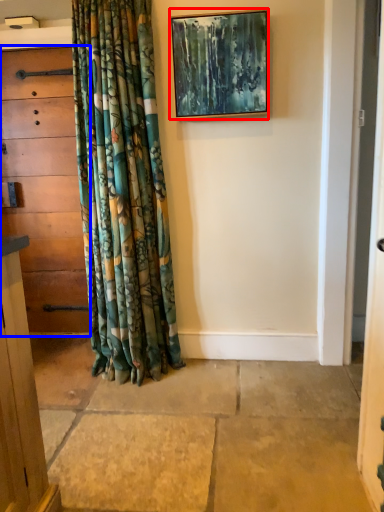
Question: Which of the following is the closest to the observer, picture frame (highlighted by a red box) or chest of drawers (highlighted by a blue box)?

Choices:
 (A) picture frame
 (B) chest of drawers

Answer: (A)